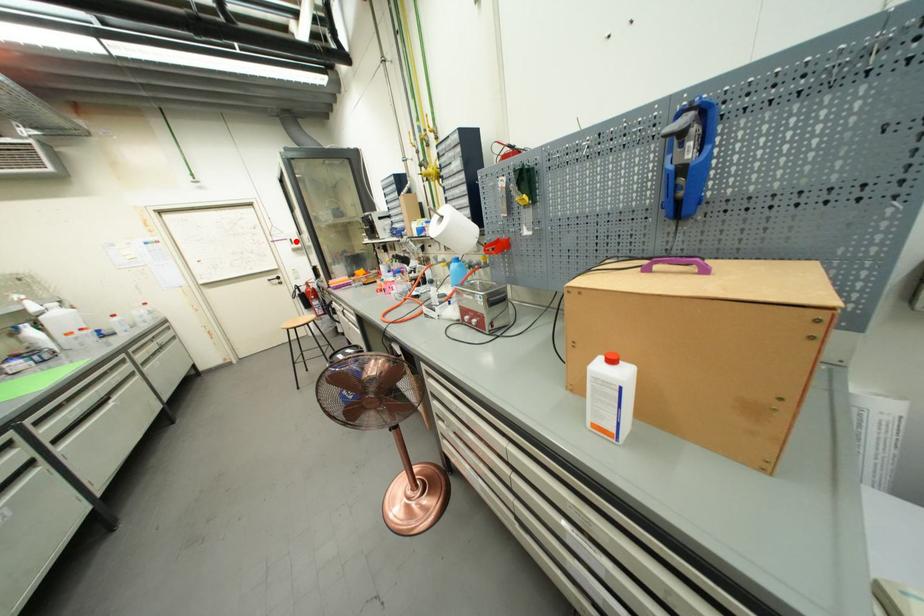
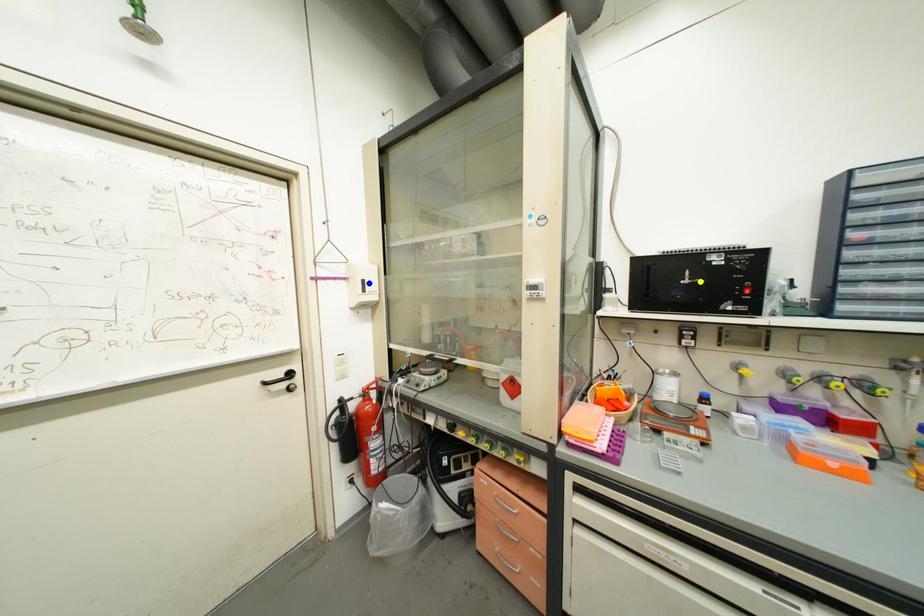
Question: I am providing you with two images of the same scene from different viewpoints. A red point is marked on the first image. You are given multiple points on the second image. In image 2, which mark is for the same physical point as the one in image 1?

Choices:
 (A) blue point
 (B) yellow point
 (C) green point

Answer: (A)